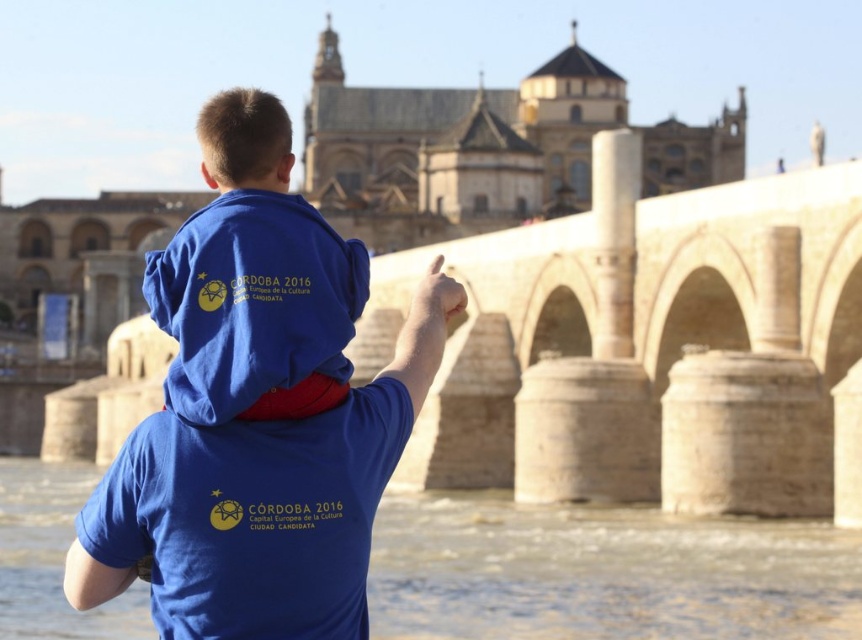
Does point (567, 468) come behind point (771, 576)?

Yes, it is behind point (771, 576).

Consider the image. Can you confirm if beige stone bridge at center is bigger than brown stone river at lower center?

Yes, beige stone bridge at center is bigger than brown stone river at lower center.

At what (x,y) coordinates should I click in order to perform the action: click on beige stone bridge at center. Please return your answer as a coordinate pair (x, y). This screenshot has height=640, width=862. Looking at the image, I should click on (678, 342).

Is blue cotton shirt at center smaller than brown stone river at lower center?

No.

Who is more forward, (166, 419) or (8, 531)?

Point (166, 419) is more forward.

Locate an element on the screen. The width and height of the screenshot is (862, 640). blue cotton shirt at center is located at coordinates (257, 410).

Between beige stone bridge at center and blue cotton shirt at center, which one is positioned higher?

beige stone bridge at center is higher up.

Is beige stone bridge at center bigger than blue cotton shirt at center?

Incorrect, beige stone bridge at center is not larger than blue cotton shirt at center.

The image size is (862, 640). In order to click on beige stone bridge at center in this screenshot , I will do `click(678, 342)`.